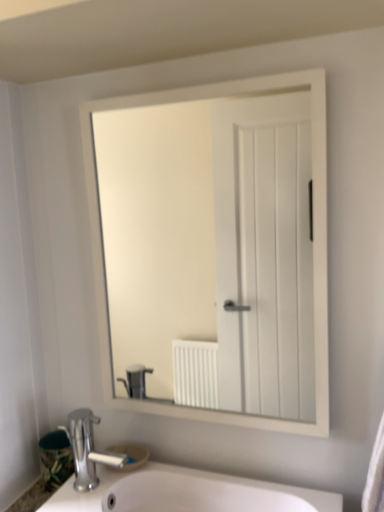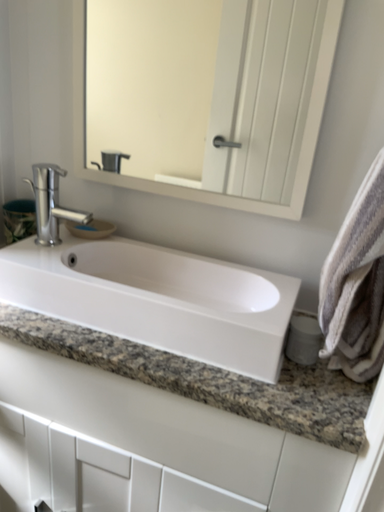
Question: Which way did the camera rotate in the video?

Choices:
 (A) rotated downward
 (B) rotated upward

Answer: (A)